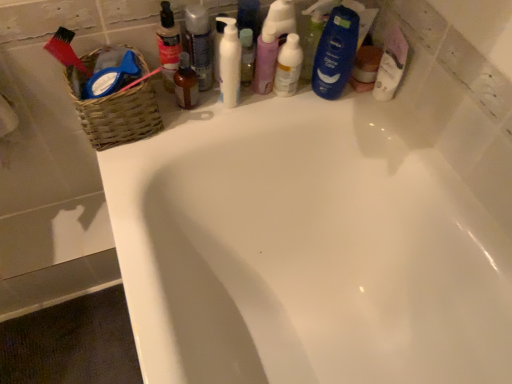
Question: Does translucent plastic bottle at upper center, which is the 1th toiletry in left-to-right order, have a larger size compared to white matte pump bottle at upper center?

Choices:
 (A) yes
 (B) no

Answer: (B)

Question: Is translucent plastic bottle at upper center, the 5th toiletry in the right-to-left sequence, completely or partially outside of white matte pump bottle at upper center?

Choices:
 (A) no
 (B) yes

Answer: (B)

Question: Can you confirm if translucent plastic bottle at upper center, the 5th toiletry in the right-to-left sequence, is taller than white matte pump bottle at upper center?

Choices:
 (A) no
 (B) yes

Answer: (A)

Question: Considering the relative sizes of translucent plastic bottle at upper center, which is the 1th toiletry in left-to-right order, and white matte pump bottle at upper center in the image provided, is translucent plastic bottle at upper center, which is the 1th toiletry in left-to-right order, shorter than white matte pump bottle at upper center?

Choices:
 (A) yes
 (B) no

Answer: (A)

Question: From the image's perspective, does translucent plastic bottle at upper center, which is the 1th toiletry in left-to-right order, appear lower than white matte pump bottle at upper center?

Choices:
 (A) yes
 (B) no

Answer: (B)

Question: Based on their sizes in the image, would you say blue glossy shampoo bottle at upper right, which ranks as the fifth toiletry in left-to-right order, is bigger or smaller than white matte pump bottle at upper center?

Choices:
 (A) small
 (B) big

Answer: (B)

Question: Does point (316, 89) appear closer or farther from the camera than point (231, 102)?

Choices:
 (A) closer
 (B) farther

Answer: (B)

Question: In the image, is blue glossy shampoo bottle at upper right, the 1th toiletry viewed from the right, positioned in front of or behind white matte pump bottle at upper center?

Choices:
 (A) behind
 (B) front

Answer: (A)

Question: From a real-world perspective, relative to white matte pump bottle at upper center, is blue glossy shampoo bottle at upper right, the 1th toiletry viewed from the right, vertically above or below?

Choices:
 (A) above
 (B) below

Answer: (A)

Question: In terms of size, does white glossy bathtub at upper center appear bigger or smaller than translucent plastic bottle at upper center, positioned as the 3th toiletry in right-to-left order?

Choices:
 (A) big
 (B) small

Answer: (A)

Question: From the image's perspective, is white glossy bathtub at upper center located above or below translucent plastic bottle at upper center, positioned as the 3th toiletry in left-to-right order?

Choices:
 (A) below
 (B) above

Answer: (A)

Question: Which is correct: white glossy bathtub at upper center is inside translucent plastic bottle at upper center, positioned as the 3th toiletry in left-to-right order, or outside of it?

Choices:
 (A) outside
 (B) inside

Answer: (A)

Question: In terms of width, does white glossy bathtub at upper center look wider or thinner when compared to translucent plastic bottle at upper center, positioned as the 3th toiletry in left-to-right order?

Choices:
 (A) thin
 (B) wide

Answer: (B)

Question: Considering the positions of translucent plastic bottle at upper center, which is the 1th toiletry in left-to-right order, and white matte pump bottle at upper center in the image, is translucent plastic bottle at upper center, which is the 1th toiletry in left-to-right order, bigger or smaller than white matte pump bottle at upper center?

Choices:
 (A) small
 (B) big

Answer: (A)

Question: Is point (159, 41) positioned closer to the camera than point (236, 72)?

Choices:
 (A) closer
 (B) farther

Answer: (B)